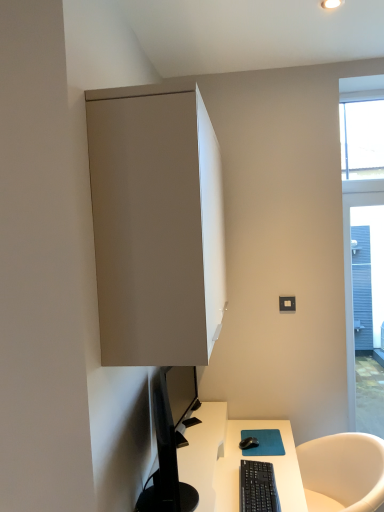
Question: From the image's perspective, is black matte mouse at lower center on top of black plastic keyboard at lower center?

Choices:
 (A) no
 (B) yes

Answer: (B)

Question: Does black matte mouse at lower center have a greater height compared to black plastic keyboard at lower center?

Choices:
 (A) yes
 (B) no

Answer: (B)

Question: Can you confirm if black matte mouse at lower center is thinner than black plastic keyboard at lower center?

Choices:
 (A) no
 (B) yes

Answer: (B)

Question: Is black matte mouse at lower center behind black plastic keyboard at lower center?

Choices:
 (A) yes
 (B) no

Answer: (A)

Question: Considering the relative positions of black matte mouse at lower center and black plastic keyboard at lower center in the image provided, is black matte mouse at lower center to the right of black plastic keyboard at lower center from the viewer's perspective?

Choices:
 (A) yes
 (B) no

Answer: (A)

Question: Is point (256, 441) closer or farther from the camera than point (195, 477)?

Choices:
 (A) closer
 (B) farther

Answer: (B)

Question: From the image's perspective, is black matte mouse at lower center located above or below white glossy desk at lower center?

Choices:
 (A) above
 (B) below

Answer: (A)

Question: In terms of width, does black matte mouse at lower center look wider or thinner when compared to white glossy desk at lower center?

Choices:
 (A) thin
 (B) wide

Answer: (A)

Question: Considering the positions of black matte mouse at lower center and white glossy desk at lower center in the image, is black matte mouse at lower center taller or shorter than white glossy desk at lower center?

Choices:
 (A) tall
 (B) short

Answer: (B)

Question: From the image's perspective, is matte gray cabinet at upper left located above or below black glossy monitor at lower left?

Choices:
 (A) above
 (B) below

Answer: (A)

Question: Does point (137, 225) appear closer or farther from the camera than point (142, 504)?

Choices:
 (A) farther
 (B) closer

Answer: (B)

Question: Based on their positions, is matte gray cabinet at upper left located to the left or right of black glossy monitor at lower left?

Choices:
 (A) left
 (B) right

Answer: (B)

Question: Is matte gray cabinet at upper left in front of or behind black glossy monitor at lower left in the image?

Choices:
 (A) front
 (B) behind

Answer: (A)

Question: From a real-world perspective, is clear glass window at upper right above or below black plastic keyboard at lower center?

Choices:
 (A) below
 (B) above

Answer: (B)

Question: From the image's perspective, is clear glass window at upper right positioned above or below black plastic keyboard at lower center?

Choices:
 (A) above
 (B) below

Answer: (A)